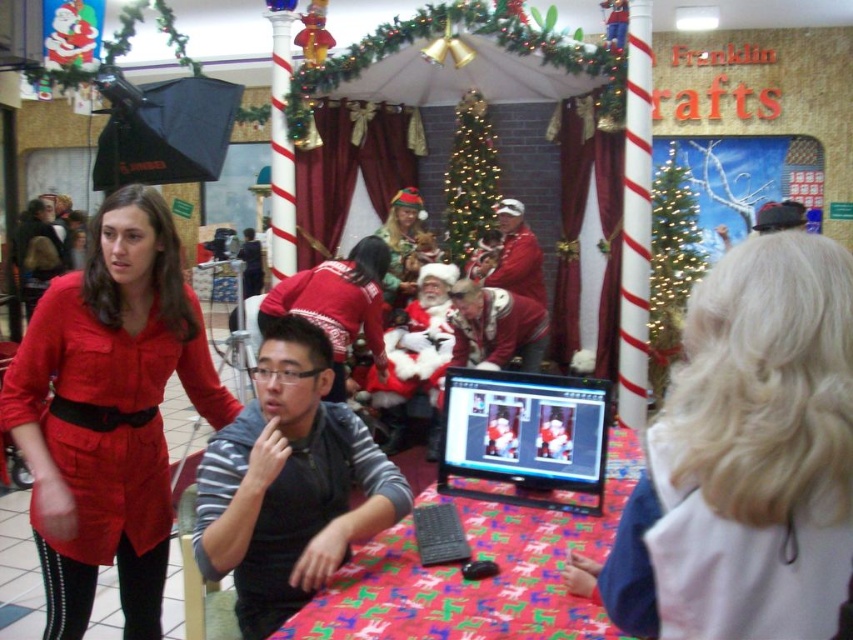
Question: Can you confirm if blonde hair at upper right is smaller than gray fabric vest at center?

Choices:
 (A) no
 (B) yes

Answer: (B)

Question: Considering the real-world distances, which object is closest to the matte black monitor at center?

Choices:
 (A) matte red shirt at left
 (B) red glossy table at center
 (C) sweater at center

Answer: (B)

Question: Which of the following is the closest to the observer?

Choices:
 (A) (672, 600)
 (B) (604, 435)
 (C) (355, 332)
 (D) (490, 259)

Answer: (A)

Question: Can you confirm if red glossy table at center is positioned to the right of matte black monitor at center?

Choices:
 (A) yes
 (B) no

Answer: (A)

Question: Can you confirm if matte red shirt at left is positioned to the right of matte black monitor at center?

Choices:
 (A) no
 (B) yes

Answer: (A)

Question: Which is farther from the gray fabric vest at center?

Choices:
 (A) blonde hair at upper right
 (B) red glossy table at center
 (C) matte black monitor at center
 (D) matte red shirt at left

Answer: (A)